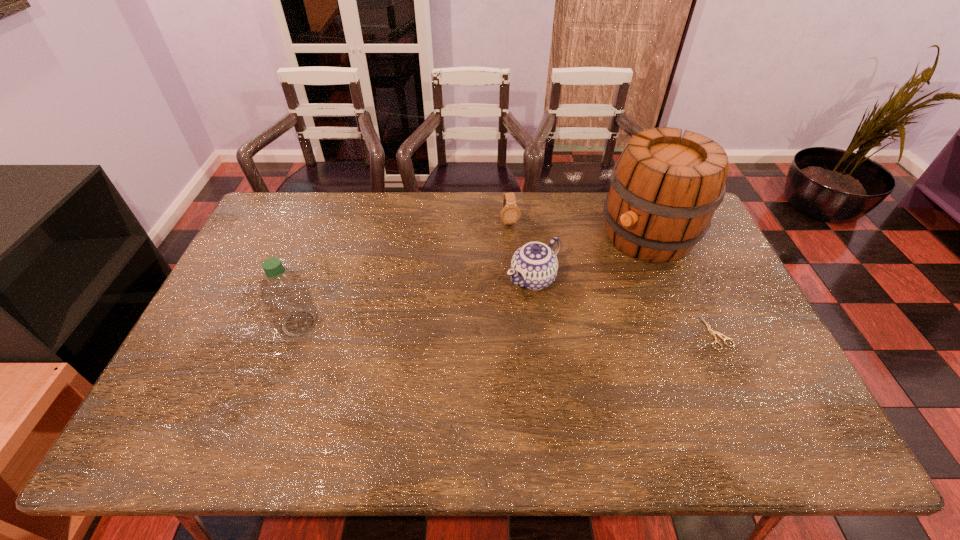
Find the location of a particular element. The width and height of the screenshot is (960, 540). empty location between the shortest object and the fourth tallest object is located at coordinates (613, 277).

Where is `free space that is in between the second shortest object and the cider`? free space that is in between the second shortest object and the cider is located at coordinates (579, 228).

Where is `unoccupied area between the fourth shortest object and the third tallest object`? The width and height of the screenshot is (960, 540). unoccupied area between the fourth shortest object and the third tallest object is located at coordinates (416, 301).

You are a GUI agent. You are given a task and a screenshot of the screen. Output one action in this format:
    pyautogui.click(x=<x>, y=<y>)
    Task: Click on the free space between the shortest object and the watch
    
    Given the screenshot: What is the action you would take?
    pyautogui.click(x=613, y=277)

Where is `empty location between the third tallest object and the leftmost object`? empty location between the third tallest object and the leftmost object is located at coordinates (416, 301).

Image resolution: width=960 pixels, height=540 pixels. Identify the location of the closest object to the chinaware. (510, 213).

Identify which object is located as the third nearest to the third tallest object. Please provide its 2D coordinates. Your answer should be formatted as a tuple, i.e. [(x, y)], where the tuple contains the x and y coordinates of a point satisfying the conditions above.

[(709, 329)]

What are the coordinates of `free location that satisfies the following two spatial constraints: 1. on the front side of the shears; 2. on the right side of the cider` in the screenshot? It's located at (687, 333).

Identify the location of vacant position in the image that satisfies the following two spatial constraints: 1. on the front side of the water bottle; 2. on the left side of the shortest object. The width and height of the screenshot is (960, 540). (296, 333).

Where is `blank space that satisfies the following two spatial constraints: 1. on the front side of the shears; 2. on the left side of the tallest object`? blank space that satisfies the following two spatial constraints: 1. on the front side of the shears; 2. on the left side of the tallest object is located at coordinates click(687, 333).